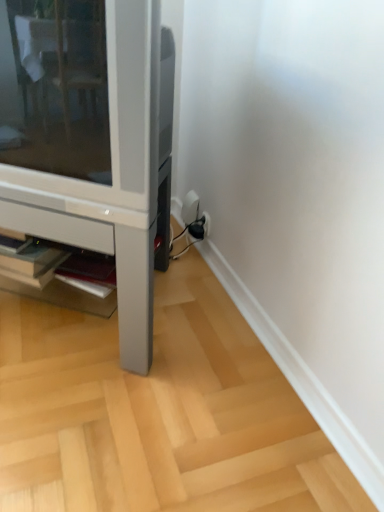
Question: Can you confirm if matte white shelf at lower center is positioned to the right of satin silver tv stand at lower left?

Choices:
 (A) no
 (B) yes

Answer: (B)

Question: Is matte white shelf at lower center to the left of satin silver tv stand at lower left from the viewer's perspective?

Choices:
 (A) yes
 (B) no

Answer: (B)

Question: Is matte white shelf at lower center facing towards satin silver tv stand at lower left?

Choices:
 (A) yes
 (B) no

Answer: (A)

Question: Considering the relative sizes of matte white shelf at lower center and satin silver tv stand at lower left in the image provided, is matte white shelf at lower center smaller than satin silver tv stand at lower left?

Choices:
 (A) no
 (B) yes

Answer: (B)

Question: From the image's perspective, would you say matte white shelf at lower center is shown under satin silver tv stand at lower left?

Choices:
 (A) no
 (B) yes

Answer: (B)

Question: Is matte white shelf at lower center in front of satin silver tv stand at lower left?

Choices:
 (A) yes
 (B) no

Answer: (B)

Question: Is satin silver tv stand at lower left facing away from matte white shelf at lower center?

Choices:
 (A) yes
 (B) no

Answer: (A)

Question: Is satin silver tv stand at lower left shorter than matte white shelf at lower center?

Choices:
 (A) yes
 (B) no

Answer: (B)

Question: Could you tell me if satin silver tv stand at lower left is turned towards matte white shelf at lower center?

Choices:
 (A) yes
 (B) no

Answer: (A)

Question: From a real-world perspective, is satin silver tv stand at lower left positioned over matte white shelf at lower center based on gravity?

Choices:
 (A) yes
 (B) no

Answer: (A)

Question: From the image's perspective, is satin silver tv stand at lower left located beneath matte white shelf at lower center?

Choices:
 (A) no
 (B) yes

Answer: (A)

Question: Considering the relative sizes of satin silver tv stand at lower left and matte white shelf at lower center in the image provided, is satin silver tv stand at lower left bigger than matte white shelf at lower center?

Choices:
 (A) no
 (B) yes

Answer: (B)

Question: Do you think matte white shelf at lower center is within satin silver tv stand at lower left, or outside of it?

Choices:
 (A) outside
 (B) inside

Answer: (B)